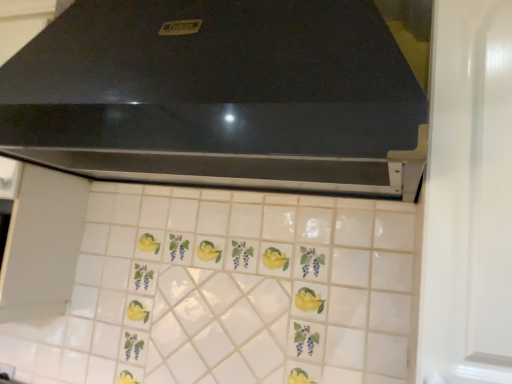
Measure the distance between black glossy range hood at upper center and camera.

black glossy range hood at upper center and camera are 26.94 inches apart.

This screenshot has height=384, width=512. Identify the location of black glossy range hood at upper center. (227, 94).

The width and height of the screenshot is (512, 384). What do you see at coordinates (227, 94) in the screenshot? I see `black glossy range hood at upper center` at bounding box center [227, 94].

The height and width of the screenshot is (384, 512). Identify the location of black glossy range hood at upper center. (227, 94).